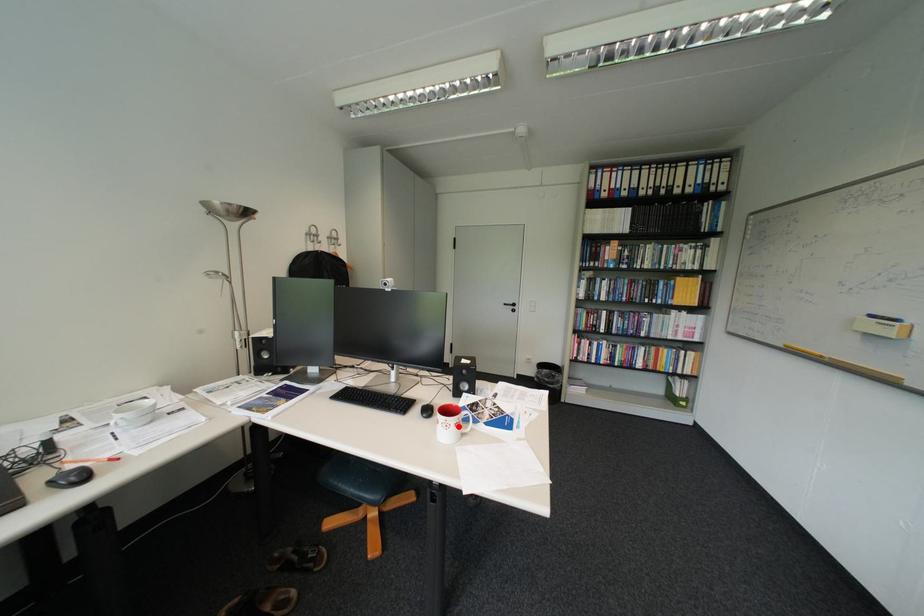
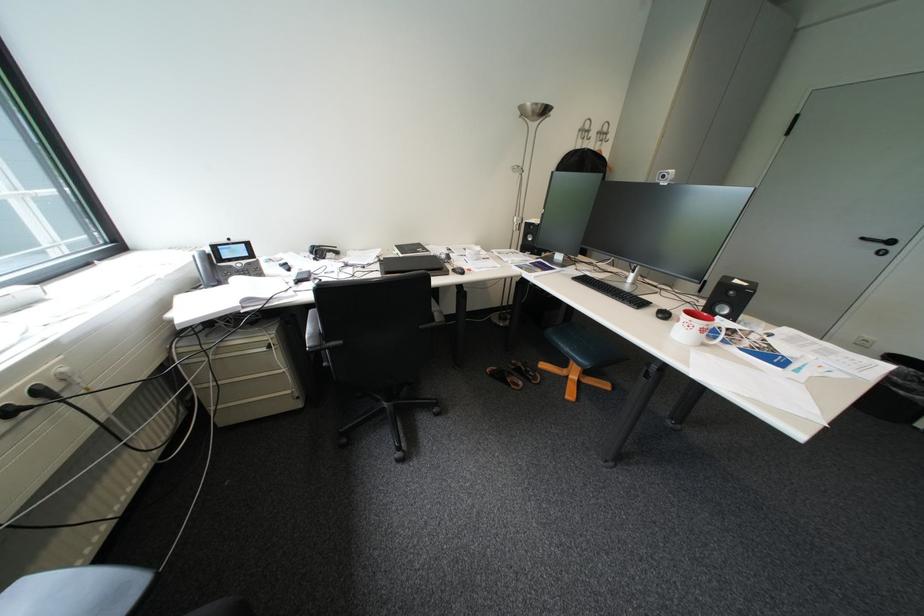
Where in the second image is the point corresponding to the highlighted location from the first image?

(700, 326)